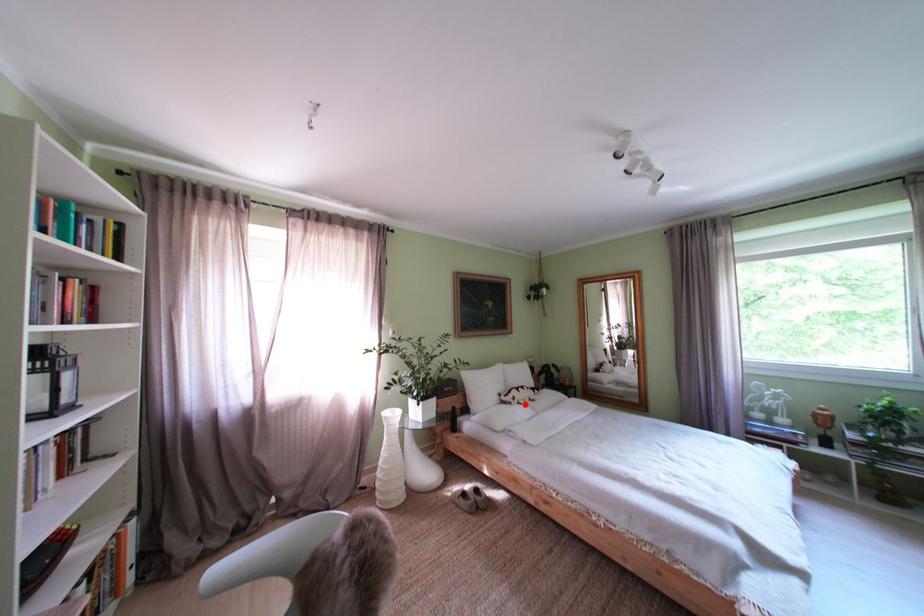
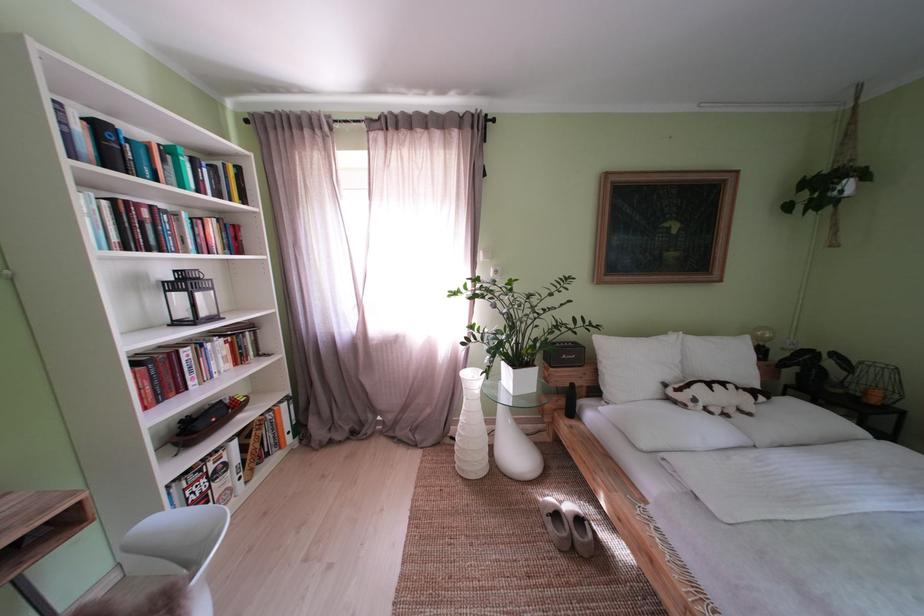
The point at the highlighted location is marked in the first image. Where is the corresponding point in the second image?

(706, 406)